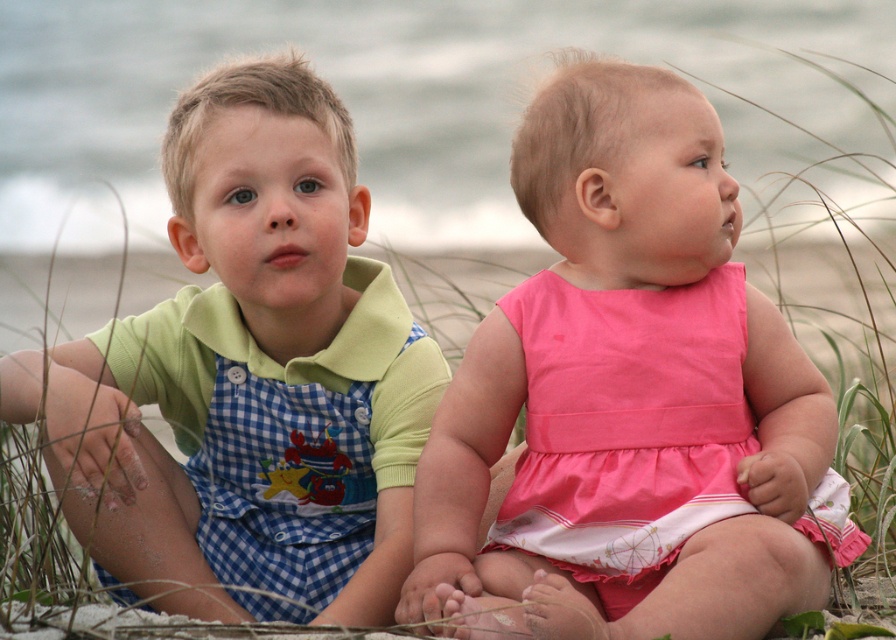
Question: Does pink satin dress at center appear on the right side of checkered fabric overalls at left?

Choices:
 (A) yes
 (B) no

Answer: (A)

Question: Does pink satin dress at center appear under checkered fabric overalls at left?

Choices:
 (A) no
 (B) yes

Answer: (B)

Question: Can you confirm if pink satin dress at center is thinner than checkered fabric overalls at left?

Choices:
 (A) no
 (B) yes

Answer: (B)

Question: Which point is farther to the camera?

Choices:
 (A) pink satin dress at center
 (B) checkered fabric overalls at left

Answer: (B)

Question: Which object is farther from the camera taking this photo?

Choices:
 (A) pink satin dress at center
 (B) checkered fabric overalls at left

Answer: (B)